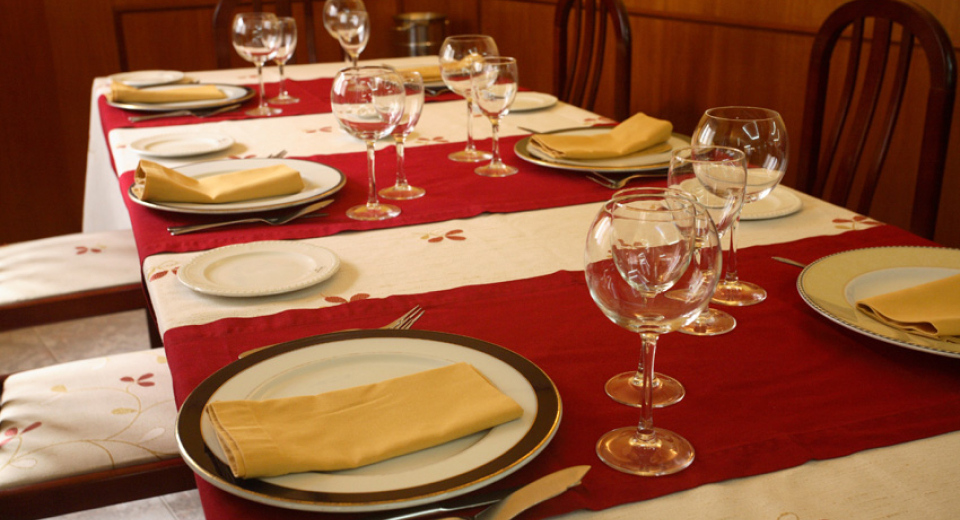
The width and height of the screenshot is (960, 520). What are the coordinates of `chairs at dining table` in the screenshot? It's located at (77, 305), (123, 486), (626, 51), (943, 103).